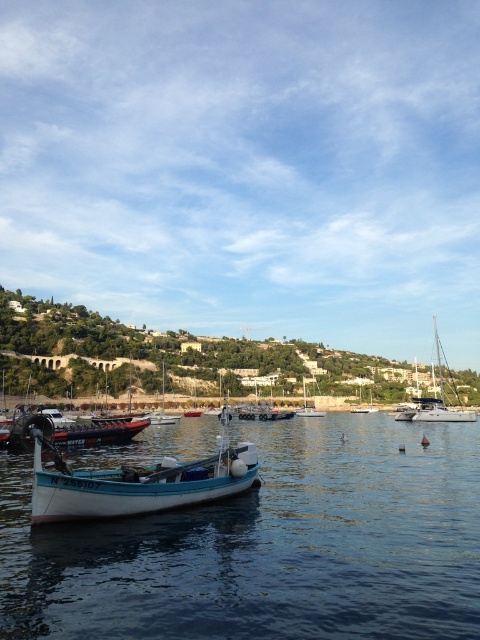
Can you confirm if brushed metal boat at center is positioned below white glossy sailboat at center?

No, brushed metal boat at center is not below white glossy sailboat at center.

Is point (43, 416) positioned behind point (312, 413)?

No.

Does point (32, 440) come closer to viewer compared to point (303, 384)?

Yes, point (32, 440) is in front of point (303, 384).

At what (x,y) coordinates should I click in order to perform the action: click on brushed metal boat at center. Please return your answer as a coordinate pair (x, y). Looking at the image, I should click on pyautogui.click(x=72, y=432).

Who is positioned more to the left, light blue wooden boat at center or white glossy sailboat at center?

light blue wooden boat at center is more to the left.

Is light blue wooden boat at center bigger than white glossy sailboat at center?

Correct, light blue wooden boat at center is larger in size than white glossy sailboat at center.

The image size is (480, 640). I want to click on light blue wooden boat at center, so click(x=141, y=483).

Which of these two, white smooth water at center or light blue wooden boat at center, stands taller?

With more height is light blue wooden boat at center.

Does point (22, 628) lie behind point (111, 497)?

No, it is not.

Where is `white smooth water at center`? white smooth water at center is located at coordinates (267, 545).